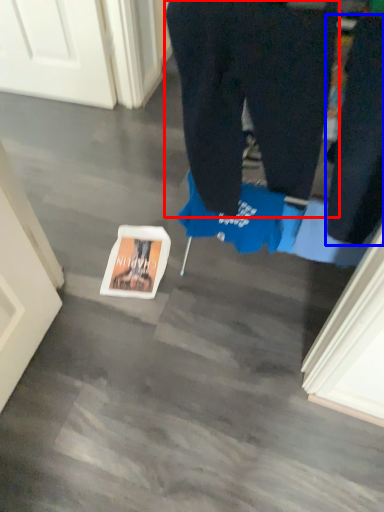
Question: Which object appears closest to the camera in this image, trousers (highlighted by a red box) or pants (highlighted by a blue box)?

Choices:
 (A) trousers
 (B) pants

Answer: (B)